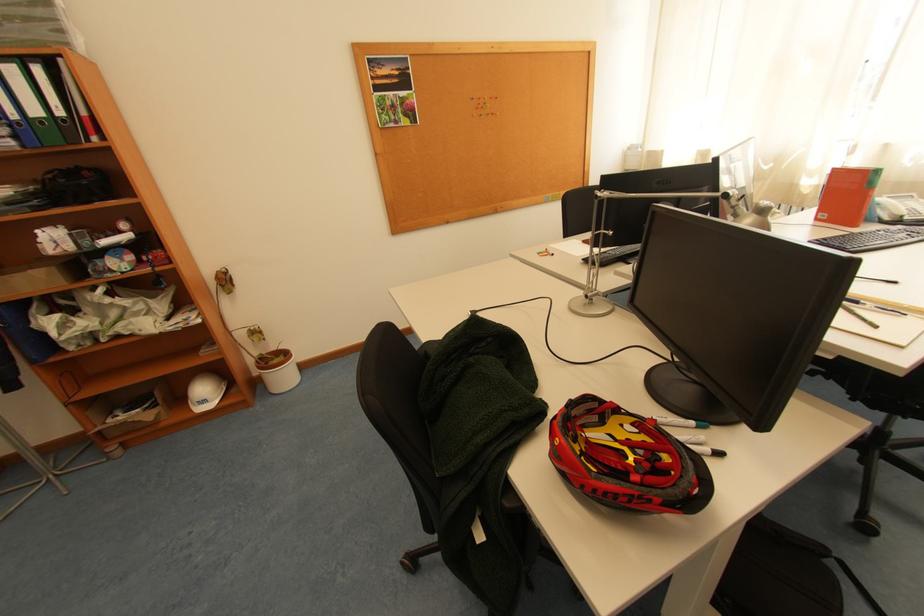
The location [205,391] corresponds to which object?

It corresponds to the white hard hat in the image.